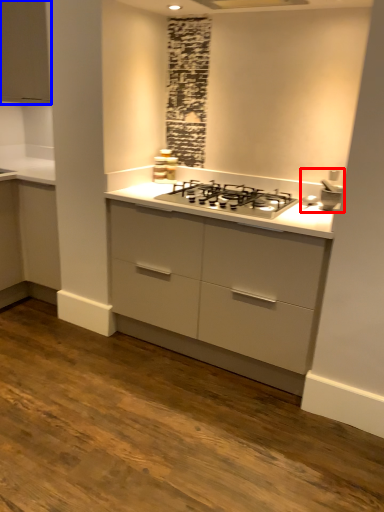
Question: Which of the following is the closest to the observer, sink (highlighted by a red box) or cabinetry (highlighted by a blue box)?

Choices:
 (A) sink
 (B) cabinetry

Answer: (A)